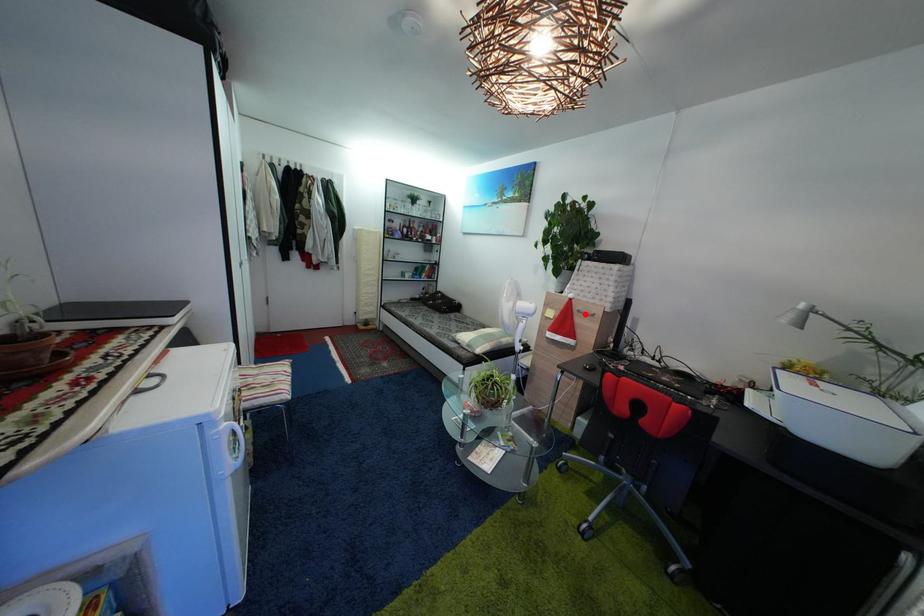
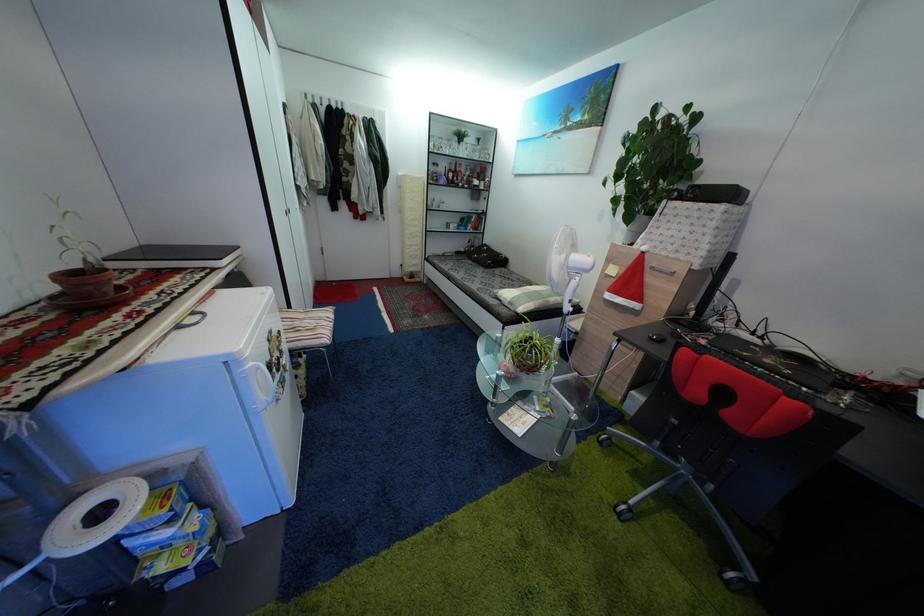
In the second image, find the point that corresponds to the highlighted location in the first image.

(659, 270)